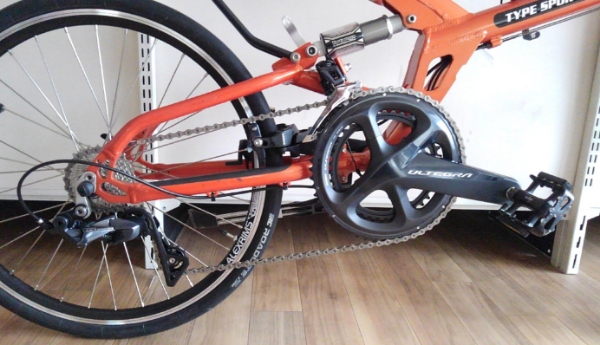
This screenshot has height=345, width=600. I want to click on space on cabinet, so click(489, 101).